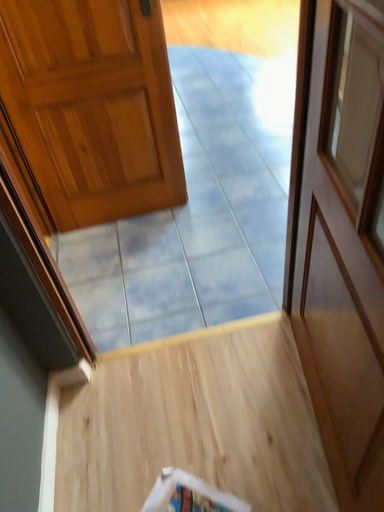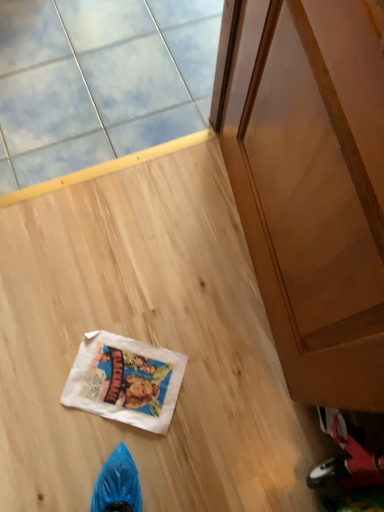
Question: How did the camera likely rotate when shooting the video?

Choices:
 (A) rotated left
 (B) rotated right

Answer: (B)